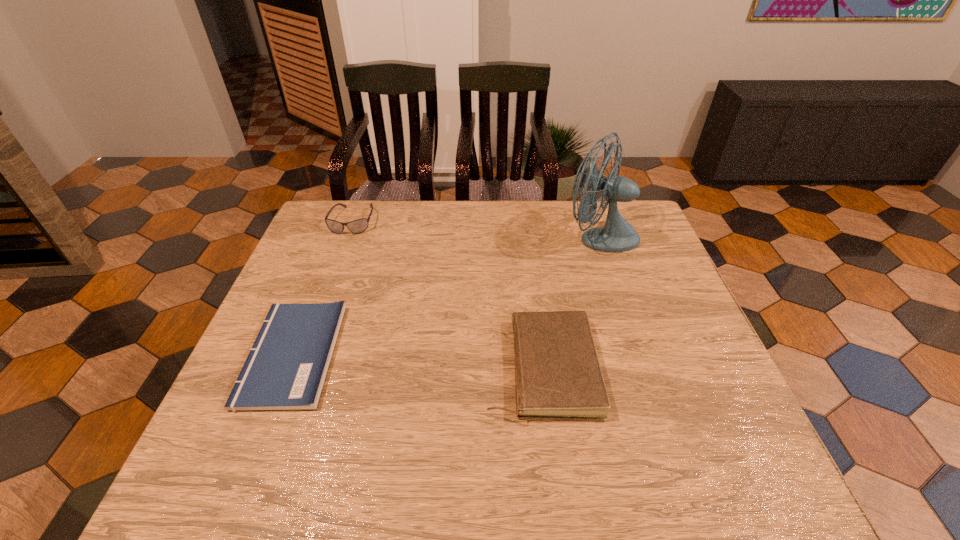
Locate an element on the screen. The height and width of the screenshot is (540, 960). vacant space at the far edge of the desktop is located at coordinates (456, 215).

The width and height of the screenshot is (960, 540). I want to click on free space at the near edge of the desktop, so click(x=463, y=492).

You are a GUI agent. You are given a task and a screenshot of the screen. Output one action in this format:
    pyautogui.click(x=<x>, y=<y>)
    Task: Click on the vacant space at the left edge of the desktop
    Image resolution: width=960 pixels, height=540 pixels.
    Given the screenshot: What is the action you would take?
    pyautogui.click(x=215, y=440)

At what (x,y) coordinates should I click in order to perform the action: click on vacant point at the right edge. Please return your answer as a coordinate pair (x, y). Looking at the image, I should click on (630, 259).

In the image, there is a desktop. Identify the location of free region at the far right corner. (638, 225).

Locate an element on the screen. blank space at the near right corner of the desktop is located at coordinates 737,455.

Locate an element on the screen. The height and width of the screenshot is (540, 960). vacant area that lies between the shorter paperback book and the fan is located at coordinates pos(446,295).

This screenshot has height=540, width=960. I want to click on empty space that is in between the shortest object and the fan, so click(446, 295).

Where is `unoccupied area between the shortest object and the sunglasses`? The height and width of the screenshot is (540, 960). unoccupied area between the shortest object and the sunglasses is located at coordinates tap(323, 288).

The height and width of the screenshot is (540, 960). Identify the location of free space between the shorter paperback book and the sunglasses. pyautogui.click(x=323, y=288).